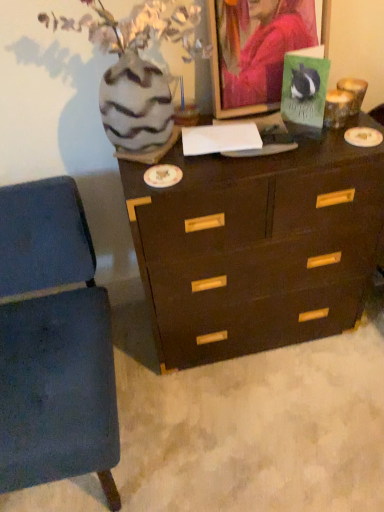
What is the approximate width of blue fabric chair at lower left?

73.62 centimeters.

Where is `matte green card at upper center`? matte green card at upper center is located at coordinates click(x=261, y=47).

The width and height of the screenshot is (384, 512). Find the location of `blue fabric chair at lower left`. blue fabric chair at lower left is located at coordinates (54, 344).

The height and width of the screenshot is (512, 384). There is a green matte postcard at upper right. Find the location of `floral arrangement above it (from a real-world perspective)`. floral arrangement above it (from a real-world perspective) is located at coordinates (142, 75).

In the scene shown: In terms of height, does green matte postcard at upper right look taller or shorter compared to speckled ceramic vase at upper left?

Clearly, green matte postcard at upper right is shorter compared to speckled ceramic vase at upper left.

Which is more to the left, green matte postcard at upper right or speckled ceramic vase at upper left?

speckled ceramic vase at upper left is more to the left.

Does speckled ceramic vase at upper left come in front of green matte postcard at upper right?

Yes, it is in front of green matte postcard at upper right.

From the image's perspective, would you say speckled ceramic vase at upper left is shown under green matte postcard at upper right?

No, from the image's perspective, speckled ceramic vase at upper left is not below green matte postcard at upper right.

Looking at this image, between speckled ceramic vase at upper left and green matte postcard at upper right, which one has less height?

Standing shorter between the two is green matte postcard at upper right.

From a real-world perspective, is green matte postcard at upper right located beneath blue fabric chair at lower left?

No, from a real-world perspective, green matte postcard at upper right is not below blue fabric chair at lower left.

Are green matte postcard at upper right and blue fabric chair at lower left beside each other?

green matte postcard at upper right and blue fabric chair at lower left are not in contact.

You are a GUI agent. You are given a task and a screenshot of the screen. Output one action in this format:
    pyautogui.click(x=<x>, y=<y>)
    Task: Click on the furniture on the left of green matte postcard at upper right
    This screenshot has height=512, width=384.
    Given the screenshot: What is the action you would take?
    pyautogui.click(x=54, y=344)

From a real-world perspective, relative to dark wood chest of drawers at center, is green matte postcard at upper right vertically above or below?

Clearly, from a real-world perspective, green matte postcard at upper right is above dark wood chest of drawers at center.

Considering the relative sizes of green matte postcard at upper right and dark wood chest of drawers at center in the image provided, is green matte postcard at upper right thinner than dark wood chest of drawers at center?

Yes.

Is green matte postcard at upper right facing away from dark wood chest of drawers at center?

green matte postcard at upper right is not turned away from dark wood chest of drawers at center.

Does point (305, 67) lie in front of point (262, 165)?

No, it is behind (262, 165).

From the image's perspective, which one is positioned lower, green matte postcard at upper right or matte green card at upper center?

From the image's view, green matte postcard at upper right is below.

Can you tell me how much green matte postcard at upper right and matte green card at upper center differ in facing direction?

47 degrees separate the facing orientations of green matte postcard at upper right and matte green card at upper center.

Which is more to the right, green matte postcard at upper right or matte green card at upper center?

green matte postcard at upper right.

Which of these two, speckled ceramic vase at upper left or dark wood chest of drawers at center, is wider?

With larger width is dark wood chest of drawers at center.

What's the angular difference between speckled ceramic vase at upper left and dark wood chest of drawers at center's facing directions?

The facing directions of speckled ceramic vase at upper left and dark wood chest of drawers at center are 0.777 degrees apart.

Which of these two, speckled ceramic vase at upper left or dark wood chest of drawers at center, is bigger?

dark wood chest of drawers at center is bigger.

Between speckled ceramic vase at upper left and dark wood chest of drawers at center, which one appears on the right side from the viewer's perspective?

dark wood chest of drawers at center is more to the right.

Considering the positions of point (257, 15) and point (303, 64), is point (257, 15) closer or farther from the camera than point (303, 64)?

Point (257, 15) is positioned closer to the camera compared to point (303, 64).

Where is `person positioned vertically above the green matte postcard at upper right (from a real-world perspective)`? person positioned vertically above the green matte postcard at upper right (from a real-world perspective) is located at coordinates (261, 47).

Looking at this image, which object is more forward, matte green card at upper center or green matte postcard at upper right?

green matte postcard at upper right is more forward.

Locate an element on the screen. The width and height of the screenshot is (384, 512). postcard behind the speckled ceramic vase at upper left is located at coordinates (304, 89).

The height and width of the screenshot is (512, 384). What are the coordinates of `floral arrangement lying in front of the green matte postcard at upper right` in the screenshot? It's located at (142, 75).

In the scene shown: Which object lies nearer to the anchor point speckled ceramic vase at upper left, dark wood chest of drawers at center or green matte postcard at upper right?

Among the two, green matte postcard at upper right is located nearer to speckled ceramic vase at upper left.

Considering their positions, is dark wood chest of drawers at center positioned closer to matte green card at upper center than green matte postcard at upper right?

Among the two, green matte postcard at upper right is located nearer to matte green card at upper center.

From the image, which object appears to be nearer to green matte postcard at upper right, blue fabric chair at lower left or matte green card at upper center?

Among the two, matte green card at upper center is located nearer to green matte postcard at upper right.

Considering their positions, is dark wood chest of drawers at center positioned further to green matte postcard at upper right than speckled ceramic vase at upper left?

Among the two, dark wood chest of drawers at center is located further to green matte postcard at upper right.

From the image, which object appears to be nearer to speckled ceramic vase at upper left, green matte postcard at upper right or matte green card at upper center?

matte green card at upper center is closer to speckled ceramic vase at upper left.

Estimate the real-world distances between objects in this image. Which object is closer to green matte postcard at upper right, matte green card at upper center or blue fabric chair at lower left?

Among the two, matte green card at upper center is located nearer to green matte postcard at upper right.

Based on their spatial positions, is green matte postcard at upper right or blue fabric chair at lower left closer to matte green card at upper center?

green matte postcard at upper right lies closer to matte green card at upper center than the other object.

When comparing their distances from speckled ceramic vase at upper left, does green matte postcard at upper right or blue fabric chair at lower left seem closer?

Based on the image, green matte postcard at upper right appears to be nearer to speckled ceramic vase at upper left.

Identify the location of postcard between speckled ceramic vase at upper left and dark wood chest of drawers at center in the vertical direction. (304, 89).

Image resolution: width=384 pixels, height=512 pixels. I want to click on postcard between matte green card at upper center and dark wood chest of drawers at center in the up-down direction, so click(x=304, y=89).

I want to click on floral arrangement that lies between matte green card at upper center and blue fabric chair at lower left from top to bottom, so click(x=142, y=75).

Locate an element on the screen. the chest of drawers that lies between matte green card at upper center and blue fabric chair at lower left from top to bottom is located at coordinates (256, 248).